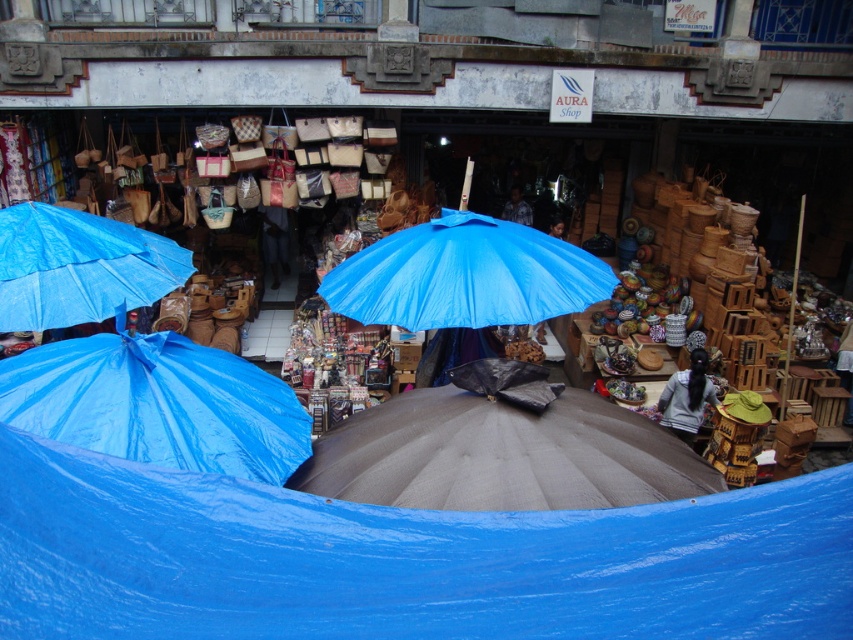
Does point (329, 294) come behind point (78, 289)?

Yes.

Does blue tarpaulin umbrella at center come in front of blue tarpaulin umbrella at upper left?

That is False.

This screenshot has width=853, height=640. Find the location of `blue tarpaulin umbrella at center`. blue tarpaulin umbrella at center is located at coordinates (465, 275).

This screenshot has width=853, height=640. I want to click on blue tarpaulin umbrella at center, so click(x=465, y=275).

Which is above, gray fabric umbrella at center or blue tarpaulin umbrella at left?

blue tarpaulin umbrella at left is higher up.

Is point (445, 387) positioned in front of point (129, 358)?

No, (445, 387) is behind (129, 358).

Does point (537, 445) come farther from viewer compared to point (194, 355)?

No.

I want to click on gray fabric umbrella at center, so click(x=502, y=449).

Can you confirm if blue tarp at center is wider than gray fabric umbrella at center?

Yes.

Who is more distant from viewer, (38, 449) or (468, 504)?

The point (468, 504) is more distant.

Where is `blue tarp at center`? The image size is (853, 640). blue tarp at center is located at coordinates (402, 560).